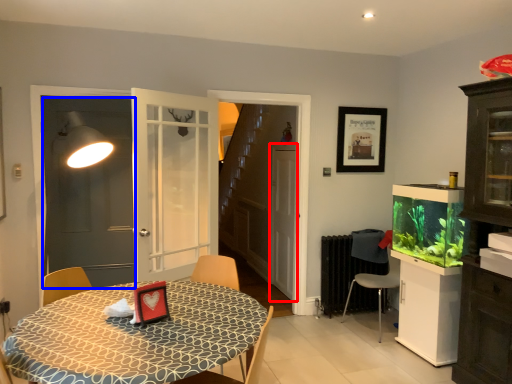
Question: Which of the following is the closest to the observer, screen door (highlighted by a red box) or screen door (highlighted by a blue box)?

Choices:
 (A) screen door
 (B) screen door

Answer: (B)